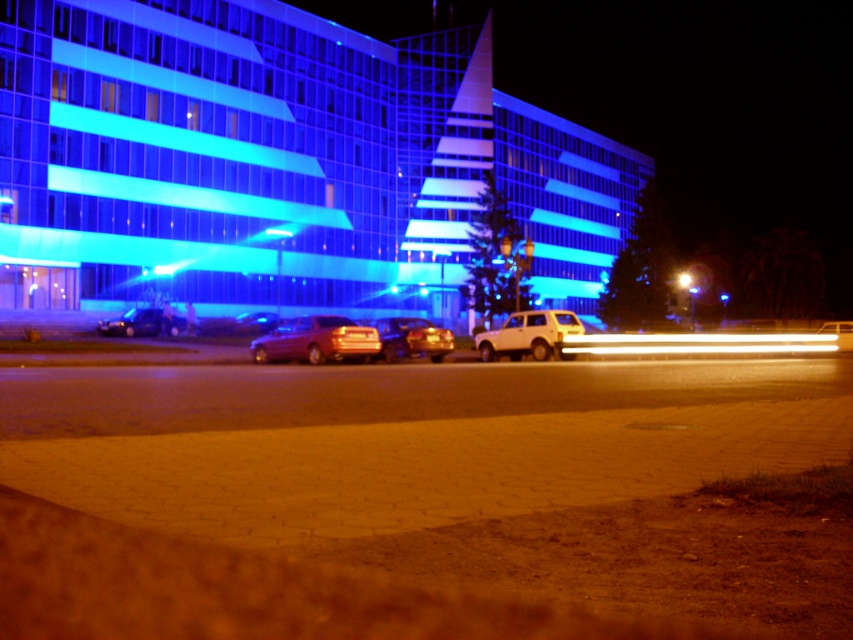
Question: Can you confirm if metallic red sedan at center is positioned to the left of shiny black sedan at center?

Choices:
 (A) no
 (B) yes

Answer: (A)

Question: Which is nearer to the white matte suv at center?

Choices:
 (A) metallic red sedan at center
 (B) metallic silver car at center
 (C) shiny black sedan at center
 (D) shiny metallic car at center

Answer: (D)

Question: Which object appears farthest from the camera in this image?

Choices:
 (A) metallic red sedan at center
 (B) shiny black sedan at center
 (C) shiny metallic car at center

Answer: (B)

Question: Among these objects, which one is nearest to the camera?

Choices:
 (A) shiny metallic car at center
 (B) metallic red sedan at center
 (C) metallic silver car at center

Answer: (B)

Question: Can you confirm if white matte suv at center is positioned above metallic silver car at center?

Choices:
 (A) no
 (B) yes

Answer: (B)

Question: In this image, where is white matte suv at center located relative to shiny metallic car at center?

Choices:
 (A) left
 (B) right

Answer: (B)